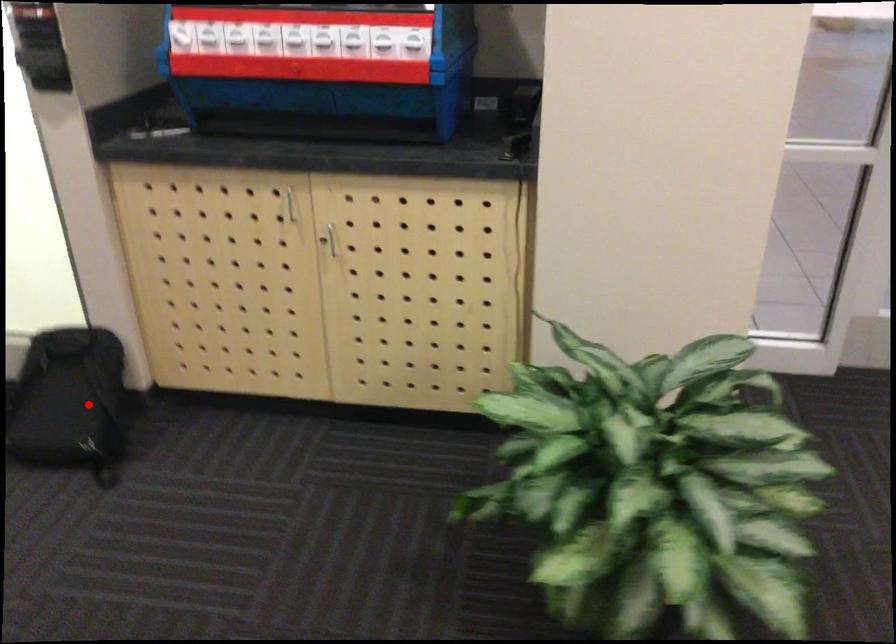
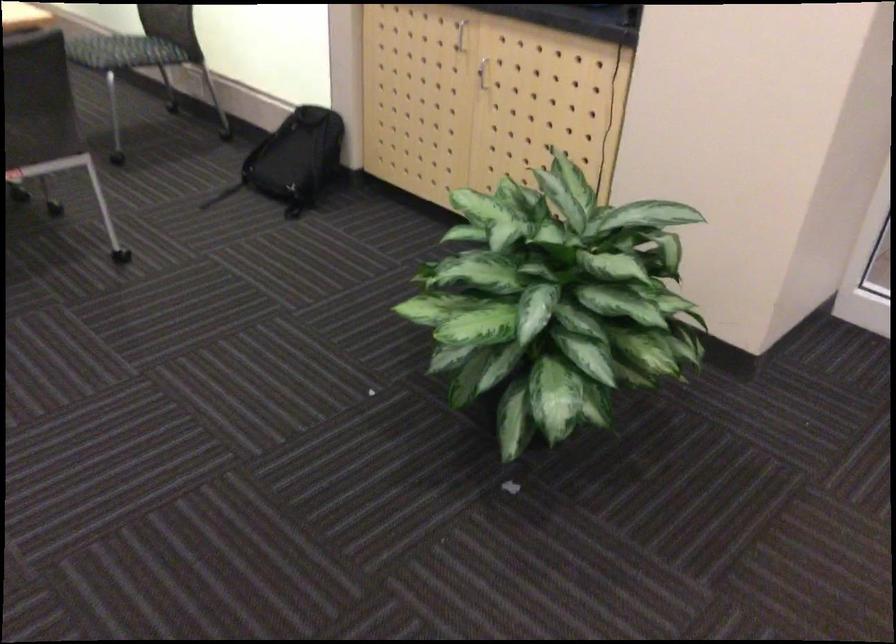
Question: I am providing you with two images of the same scene from different viewpoints. Image1 has a red point marked. In image2, the corresponding 3D location appears at what relative position? Reply with the corresponding letter.

Choices:
 (A) Closer
 (B) Farther

Answer: (B)